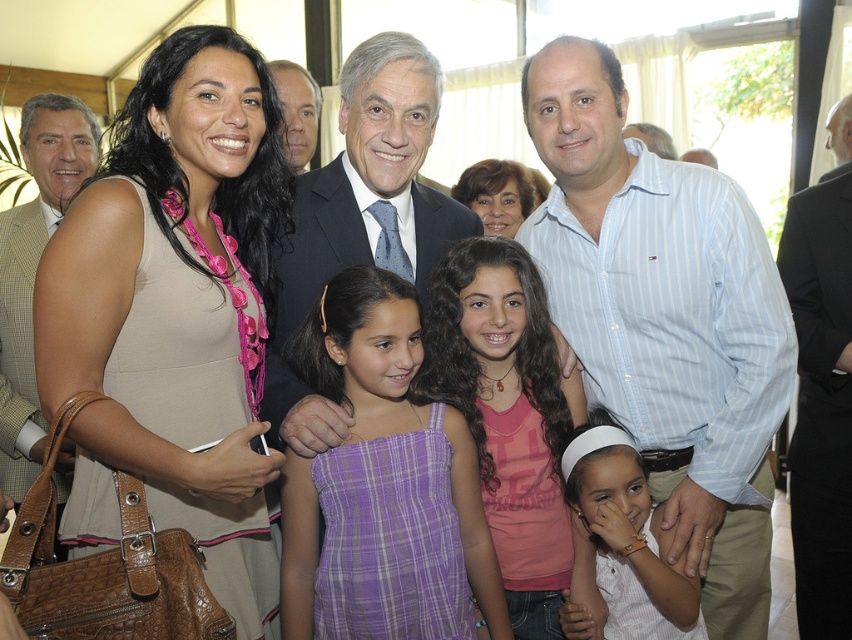
Question: Can you confirm if beige fabric dress at center is thinner than pink fabric shirt at center?

Choices:
 (A) yes
 (B) no

Answer: (A)

Question: Can you confirm if beige fabric dress at center is thinner than white matte shirt at center?

Choices:
 (A) yes
 (B) no

Answer: (B)

Question: Which object is the closest to the yellow-green checkered suit at left?

Choices:
 (A) smooth skin face at center
 (B) white matte shirt at center
 (C) black suit at center
 (D) matte pink dress at center

Answer: (A)

Question: Which point is farther to the camera?

Choices:
 (A) (478, 604)
 (B) (830, 365)

Answer: (B)

Question: Can you confirm if yellow-green checkered suit at left is smaller than smooth skin face at center?

Choices:
 (A) no
 (B) yes

Answer: (A)

Question: Estimate the real-world distances between objects in this image. Which object is farther from the purple plaid dress at center?

Choices:
 (A) black suit at center
 (B) pink fabric shirt at center
 (C) smooth skin face at center

Answer: (A)